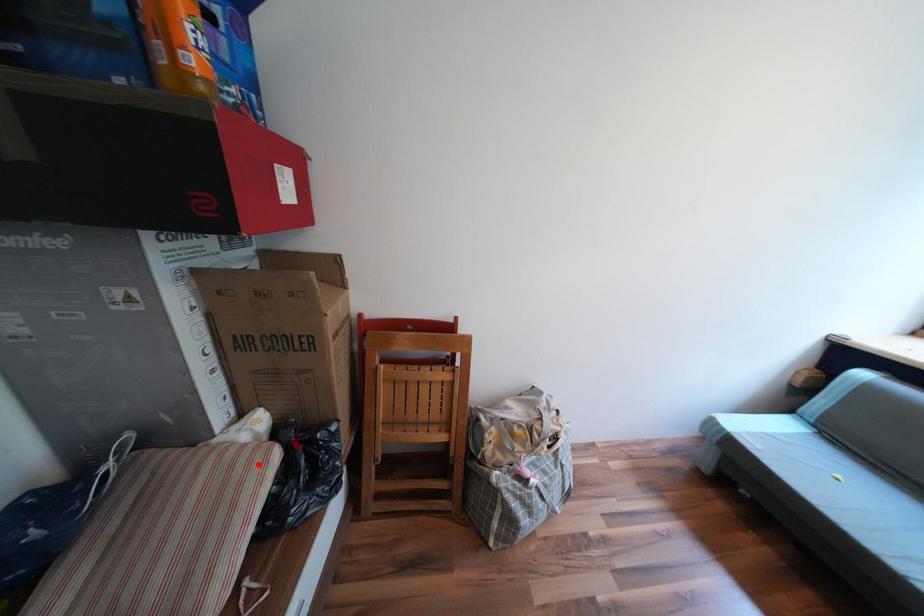
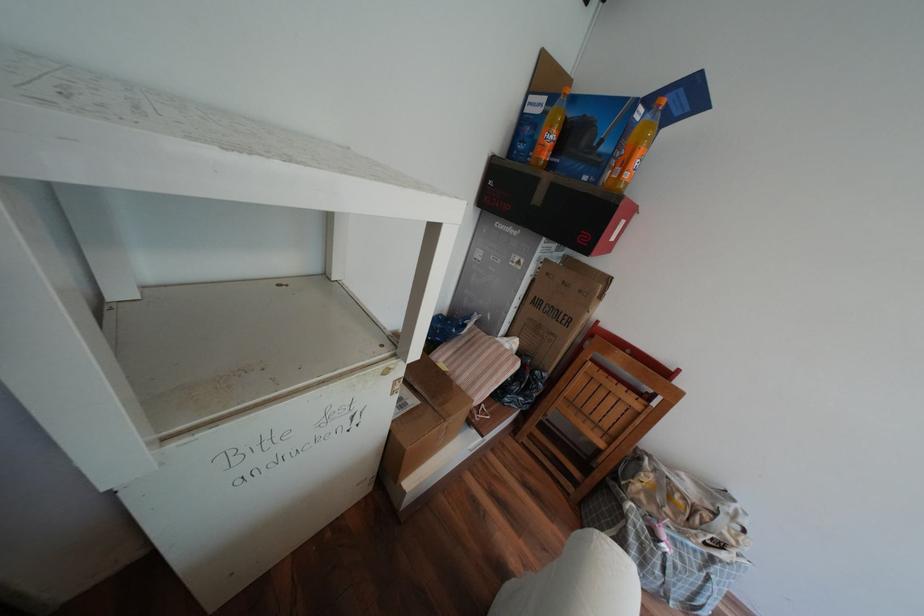
Find the pixel in the second image that matches the highlighted location in the first image.

(517, 360)